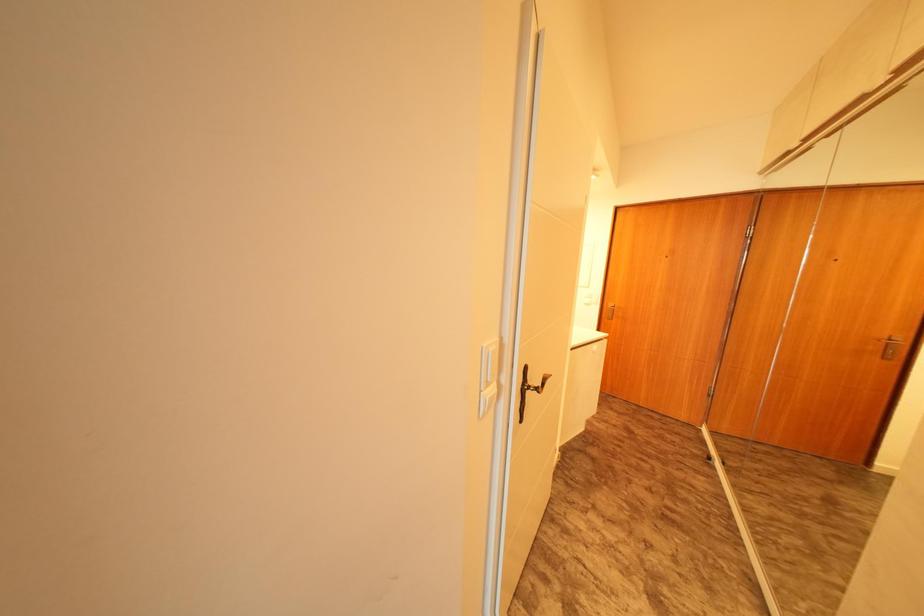
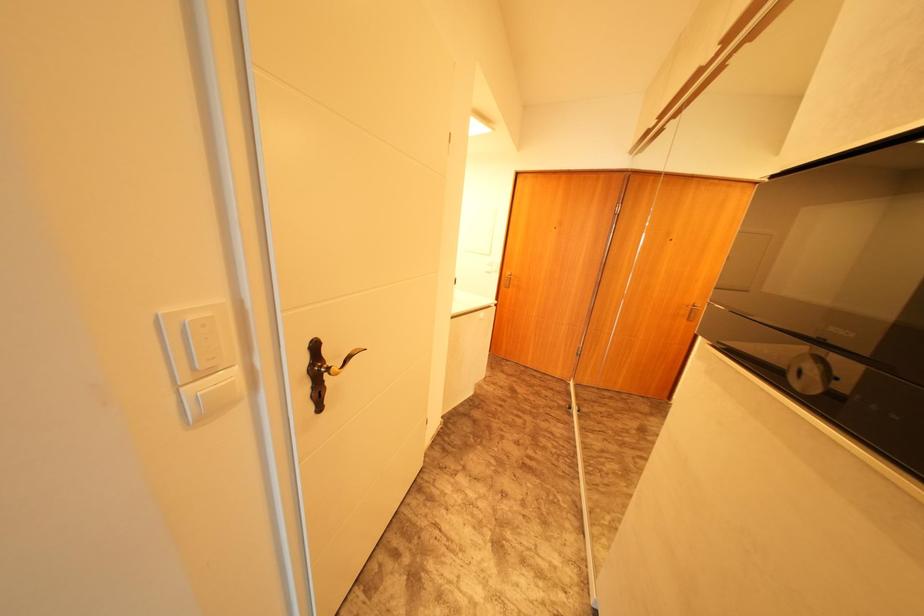
The images are taken continuously from a first-person perspective. In which direction are you moving?

The cameraman walked toward right, forward.